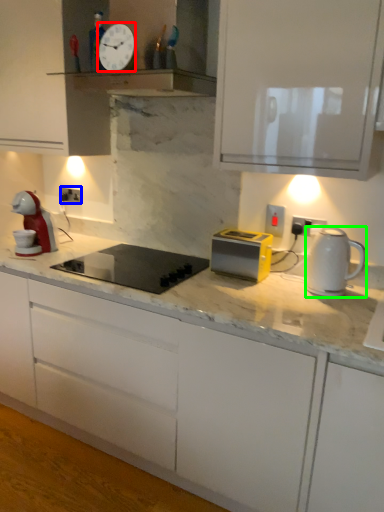
Question: Which object is positioned closest to clock (highlighted by a red box)? Select from electric outlet (highlighted by a blue box) and kitchen appliance (highlighted by a green box).

Choices:
 (A) electric outlet
 (B) kitchen appliance

Answer: (A)